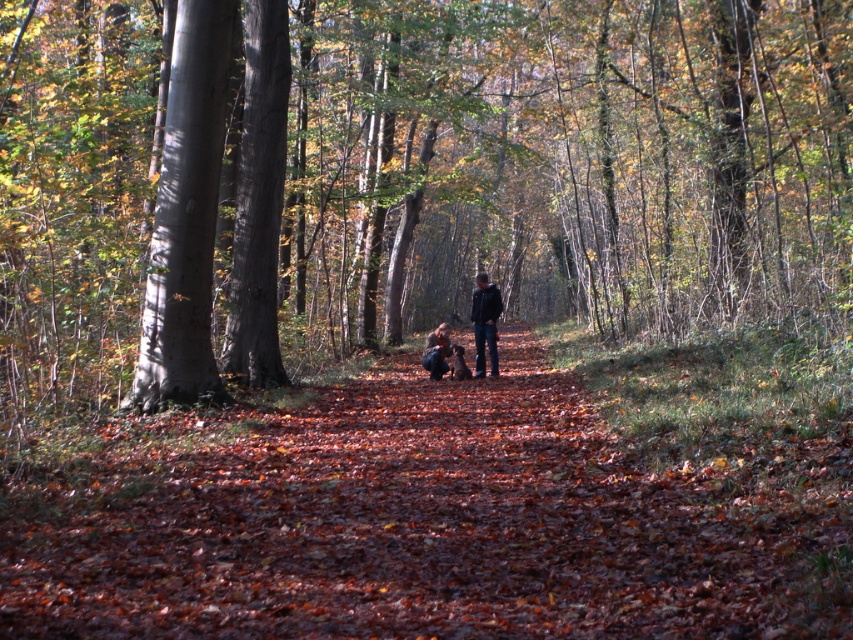
Is smooth bark tree at left to the left of dark blue jeans at center from the viewer's perspective?

Correct, you'll find smooth bark tree at left to the left of dark blue jeans at center.

Between smooth bark tree at left and dark blue jeans at center, which one appears on the right side from the viewer's perspective?

Positioned to the right is dark blue jeans at center.

Does point (196, 244) lie behind point (437, 346)?

No, it is not.

Where is `smooth bark tree at left`? smooth bark tree at left is located at coordinates (186, 214).

Between point (288, 355) and point (482, 298), which one is positioned in front?

Point (482, 298) is more forward.

Can you confirm if smooth bark tree at center is taller than dark blue jacket at center?

Yes.

Which is behind, point (21, 304) or point (476, 328)?

Positioned behind is point (476, 328).

Find the location of a particular element. The image size is (853, 640). smooth bark tree at center is located at coordinates (566, 164).

Which is more to the right, dark blue jacket at center or dark blue jeans at center?

Positioned to the right is dark blue jacket at center.

You are a GUI agent. You are given a task and a screenshot of the screen. Output one action in this format:
    pyautogui.click(x=<x>, y=<y>)
    Task: Click on the dark blue jacket at center
    The height and width of the screenshot is (640, 853).
    Given the screenshot: What is the action you would take?
    pyautogui.click(x=485, y=323)